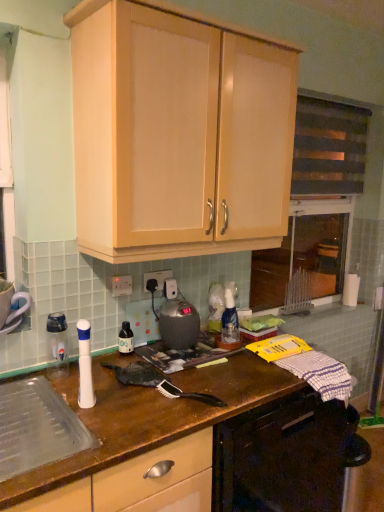
Question: In the image, is dark fabric window screen at upper right on the left side or the right side of matte black bottle at center?

Choices:
 (A) right
 (B) left

Answer: (A)

Question: Is dark fabric window screen at upper right in front of or behind matte black bottle at center in the image?

Choices:
 (A) behind
 (B) front

Answer: (A)

Question: Which is nearer to the clear plastic bottle at left?

Choices:
 (A) wooden at center
 (B) metallic gray kettle at center
 (C) dark fabric window screen at upper right
 (D) white plastic electric outlet at center, acting as the second electric outlet starting from the front
 (E) matte black bottle at center

Answer: (E)

Question: Considering the real-world distances, which object is closest to the wooden at center?

Choices:
 (A) white plastic electric outlet at center, the second electric outlet positioned from the left
 (B) white plastic electric outlet at center, the second electric outlet from the back
 (C) matte black bottle at center
 (D) dark fabric window screen at upper right
 (E) metallic gray kettle at center

Answer: (E)